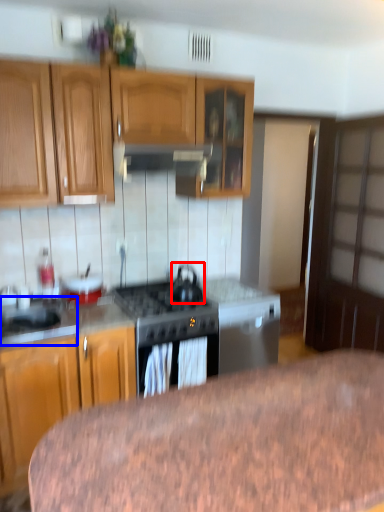
Question: Which of the following is the farthest to the observer, kitchen appliance (highlighted by a red box) or sink (highlighted by a blue box)?

Choices:
 (A) kitchen appliance
 (B) sink

Answer: (A)